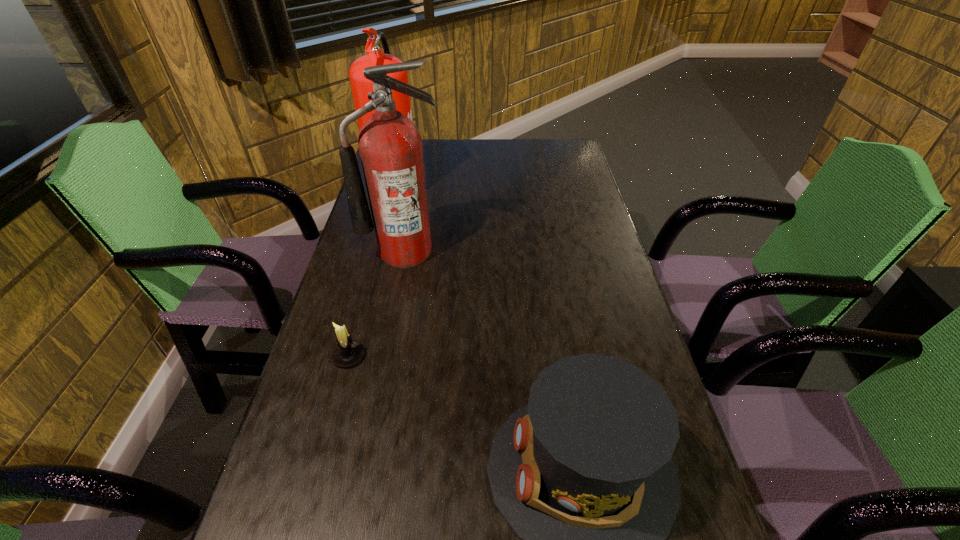
Where is `the nearer fire extinguisher`? The width and height of the screenshot is (960, 540). the nearer fire extinguisher is located at coordinates (390, 145).

Where is `the farthest object`? This screenshot has height=540, width=960. the farthest object is located at coordinates (360, 86).

Find the location of a particular element. The image size is (960, 540). the third farthest object is located at coordinates (347, 352).

You are a GUI agent. You are given a task and a screenshot of the screen. Output one action in this format:
    pyautogui.click(x=<x>, y=<y>)
    Task: Click on the shortest object
    
    Given the screenshot: What is the action you would take?
    pyautogui.click(x=347, y=352)

Locate an element on the screen. This screenshot has width=960, height=540. vacant space located on the front of the nearer fire extinguisher near the operation label is located at coordinates (398, 284).

Image resolution: width=960 pixels, height=540 pixels. Find the location of `free location located 0.260m towards the nozzle of the farthest object`. free location located 0.260m towards the nozzle of the farthest object is located at coordinates (496, 184).

Where is `vacant space located 0.050m on the front of the third farthest object`? vacant space located 0.050m on the front of the third farthest object is located at coordinates (340, 389).

Find the location of a particular element. object present at the far edge is located at coordinates (360, 86).

Locate an element on the screen. The image size is (960, 540). candle holder present at the left edge is located at coordinates (347, 352).

The image size is (960, 540). In order to click on object at the far left corner in this screenshot , I will do `click(360, 86)`.